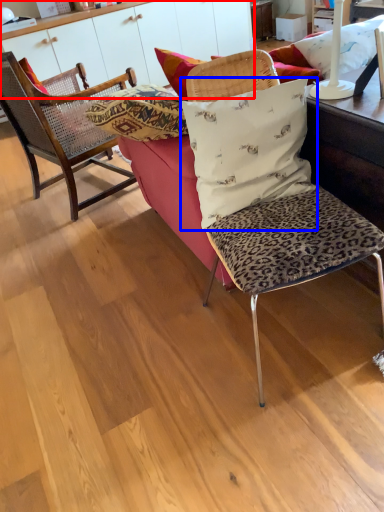
Question: Which point is closer to the camera, dresser (highlighted by a red box) or pillow (highlighted by a blue box)?

Choices:
 (A) dresser
 (B) pillow

Answer: (B)